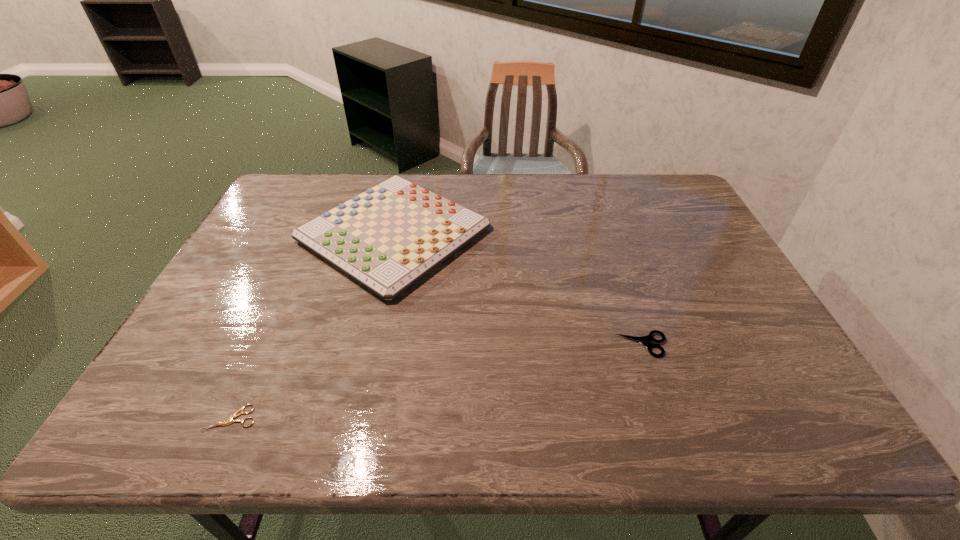
Identify the location of the farthest object. The width and height of the screenshot is (960, 540). (386, 238).

Where is `gameboard`? gameboard is located at coordinates (386, 238).

Identify the location of the taller shears. (645, 340).

I want to click on the second tallest object, so click(645, 340).

The image size is (960, 540). I want to click on the nearest object, so click(235, 415).

The image size is (960, 540). I want to click on the nearer shears, so click(235, 415).

This screenshot has height=540, width=960. Find the location of `free point located 0.140m on the left of the farthest object`. free point located 0.140m on the left of the farthest object is located at coordinates (253, 234).

This screenshot has height=540, width=960. In order to click on vacant position located 0.170m on the front of the farther shears in this screenshot , I will do `click(669, 424)`.

The height and width of the screenshot is (540, 960). What are the coordinates of `vacant area situated on the back of the shorter shears` in the screenshot? It's located at (250, 377).

The image size is (960, 540). I want to click on object situated at the far edge, so click(x=386, y=238).